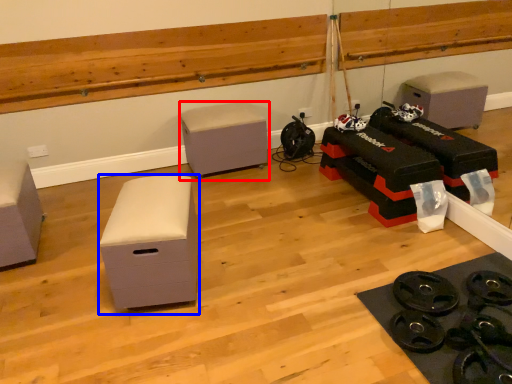
Question: Which point is closer to the camera, furniture (highlighted by a red box) or furniture (highlighted by a blue box)?

Choices:
 (A) furniture
 (B) furniture

Answer: (B)